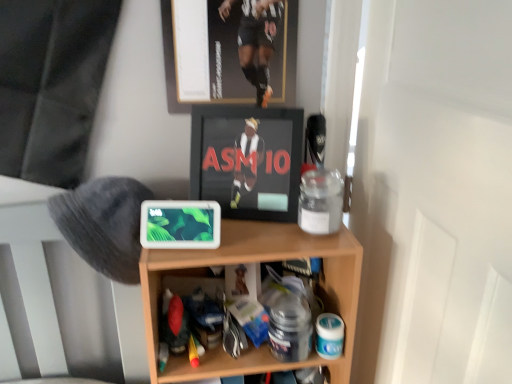
What do you see at coordinates (225, 57) in the screenshot? I see `metallic gold picture frame at upper center` at bounding box center [225, 57].

The width and height of the screenshot is (512, 384). What do you see at coordinates (254, 262) in the screenshot? I see `wooden shelf at center` at bounding box center [254, 262].

What is the approximate height of wooden shelf at center?

The height of wooden shelf at center is 25.92 inches.

Locate an element on the screen. gray fuzzy hat at left is located at coordinates (33, 265).

Would you say wooden shelf at center is inside or outside metallic gold picture frame at upper center?

wooden shelf at center exists outside the volume of metallic gold picture frame at upper center.

This screenshot has width=512, height=384. In order to click on shelf that is in front of the metallic gold picture frame at upper center in this screenshot , I will do `click(254, 262)`.

Is wooden shelf at center with metallic gold picture frame at upper center?

wooden shelf at center and metallic gold picture frame at upper center are clearly separated.

Which of these two, black glossy frame at center or wooden shelf at center, stands shorter?

Standing shorter between the two is black glossy frame at center.

Looking at this image, from the image's perspective, relative to wooden shelf at center, is black glossy frame at center above or below?

Based on their image positions, black glossy frame at center is located above wooden shelf at center.

You are a GUI agent. You are given a task and a screenshot of the screen. Output one action in this format:
    pyautogui.click(x=<x>, y=<y>)
    Task: Click on the shelf in front of the black glossy frame at center
    This screenshot has height=384, width=512.
    Given the screenshot: What is the action you would take?
    [254, 262]

Is the surface of black glossy frame at center in direct contact with wooden shelf at center?

There is a gap between black glossy frame at center and wooden shelf at center.

Between gray fuzzy hat at left and metallic gold picture frame at upper center, which one has larger size?

gray fuzzy hat at left is bigger.

How much distance is there between gray fuzzy hat at left and metallic gold picture frame at upper center?

gray fuzzy hat at left is 50.72 centimeters from metallic gold picture frame at upper center.

From their relative heights in the image, would you say gray fuzzy hat at left is taller or shorter than metallic gold picture frame at upper center?

gray fuzzy hat at left is shorter than metallic gold picture frame at upper center.

How many degrees apart are the facing directions of gray fuzzy hat at left and metallic gold picture frame at upper center?

2.84 degrees.

Is wooden shelf at center looking in the opposite direction of black glossy frame at center?

wooden shelf at center does not have its back to black glossy frame at center.

Are wooden shelf at center and black glossy frame at center located far from each other?

No, wooden shelf at center is in close proximity to black glossy frame at center.

From the image's perspective, is wooden shelf at center beneath black glossy frame at center?

Yes.

Does wooden shelf at center have a greater width compared to black glossy frame at center?

Indeed, wooden shelf at center has a greater width compared to black glossy frame at center.

Image resolution: width=512 pixels, height=384 pixels. What are the coordinates of `picture frame above the black glossy frame at center (from a real-world perspective)` in the screenshot? It's located at (225, 57).

Which object is thinner, black glossy frame at center or metallic gold picture frame at upper center?

metallic gold picture frame at upper center is thinner.

What's the angular difference between black glossy frame at center and metallic gold picture frame at upper center's facing directions?

The angular difference between black glossy frame at center and metallic gold picture frame at upper center is 18.6 degrees.

Could metallic gold picture frame at upper center be considered to be inside black glossy frame at center?

No, black glossy frame at center does not contain metallic gold picture frame at upper center.

From the picture: Is wooden shelf at center wider than gray fuzzy hat at left?

Correct, the width of wooden shelf at center exceeds that of gray fuzzy hat at left.

Based on the photo, from the image's perspective, is wooden shelf at center positioned above or below gray fuzzy hat at left?

Based on their image positions, wooden shelf at center is located beneath gray fuzzy hat at left.

Are wooden shelf at center and gray fuzzy hat at left located far from each other?

No, wooden shelf at center is not far from gray fuzzy hat at left.

Choose the correct answer: Is gray fuzzy hat at left inside black glossy frame at center or outside it?

gray fuzzy hat at left lies outside black glossy frame at center.

Which is closer to the camera, (x=38, y=295) or (x=246, y=153)?

Point (x=38, y=295).

In the scene shown: From the image's perspective, which object appears higher, gray fuzzy hat at left or black glossy frame at center?

From the image's view, black glossy frame at center is above.

Is gray fuzzy hat at left taller than black glossy frame at center?

Indeed, gray fuzzy hat at left has a greater height compared to black glossy frame at center.

Locate an element on the screen. Image resolution: width=512 pixels, height=384 pixels. shelf that is on the right side of metallic gold picture frame at upper center is located at coordinates (254, 262).

Locate an element on the screen. shelf on the left of black glossy frame at center is located at coordinates (254, 262).

Estimate the real-world distances between objects in this image. Which object is further from wooden shelf at center, gray fuzzy hat at left or black glossy frame at center?

gray fuzzy hat at left.

In the scene shown: Which object lies nearer to the anchor point gray fuzzy hat at left, wooden shelf at center or metallic gold picture frame at upper center?

Among the two, wooden shelf at center is located nearer to gray fuzzy hat at left.

Which object lies nearer to the anchor point metallic gold picture frame at upper center, wooden shelf at center or gray fuzzy hat at left?

Based on the image, wooden shelf at center appears to be nearer to metallic gold picture frame at upper center.

When comparing their distances from wooden shelf at center, does black glossy frame at center or metallic gold picture frame at upper center seem closer?

Based on the image, black glossy frame at center appears to be nearer to wooden shelf at center.

When comparing their distances from black glossy frame at center, does wooden shelf at center or metallic gold picture frame at upper center seem closer?

metallic gold picture frame at upper center.

Which object lies nearer to the anchor point black glossy frame at center, metallic gold picture frame at upper center or wooden shelf at center?

metallic gold picture frame at upper center.

Based on their spatial positions, is metallic gold picture frame at upper center or black glossy frame at center closer to gray fuzzy hat at left?

→ black glossy frame at center is positioned closer to the anchor gray fuzzy hat at left.

Estimate the real-world distances between objects in this image. Which object is further from metallic gold picture frame at upper center, black glossy frame at center or gray fuzzy hat at left?

Among the two, gray fuzzy hat at left is located further to metallic gold picture frame at upper center.

You are a GUI agent. You are given a task and a screenshot of the screen. Output one action in this format:
    pyautogui.click(x=<x>, y=<y>)
    Task: Click on the wide between metallic gold picture frame at upper center and gray fuzzy hat at left in the vertical direction
    The height and width of the screenshot is (384, 512).
    Given the screenshot: What is the action you would take?
    pyautogui.click(x=247, y=160)

This screenshot has height=384, width=512. I want to click on wide between metallic gold picture frame at upper center and wooden shelf at center from top to bottom, so click(x=247, y=160).

I want to click on bed frame that lies between metallic gold picture frame at upper center and wooden shelf at center from top to bottom, so click(33, 265).

Where is `bed frame between black glossy frame at center and wooden shelf at center from top to bottom`? bed frame between black glossy frame at center and wooden shelf at center from top to bottom is located at coordinates (33, 265).